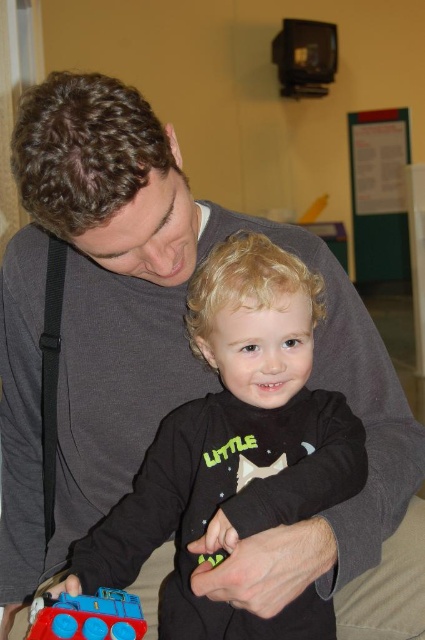
Can you confirm if black matte shirt at center is smaller than rubberized blue train at lower left?

Incorrect, black matte shirt at center is not smaller in size than rubberized blue train at lower left.

Consider the image. Is black matte shirt at center in front of rubberized blue train at lower left?

No, it is behind rubberized blue train at lower left.

Image resolution: width=425 pixels, height=640 pixels. I want to click on black matte shirt at center, so click(x=235, y=449).